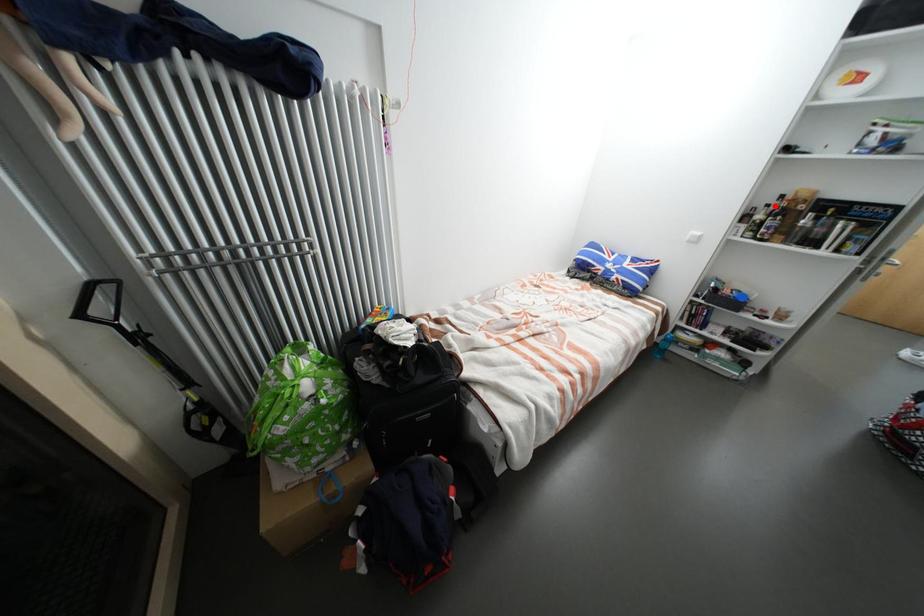
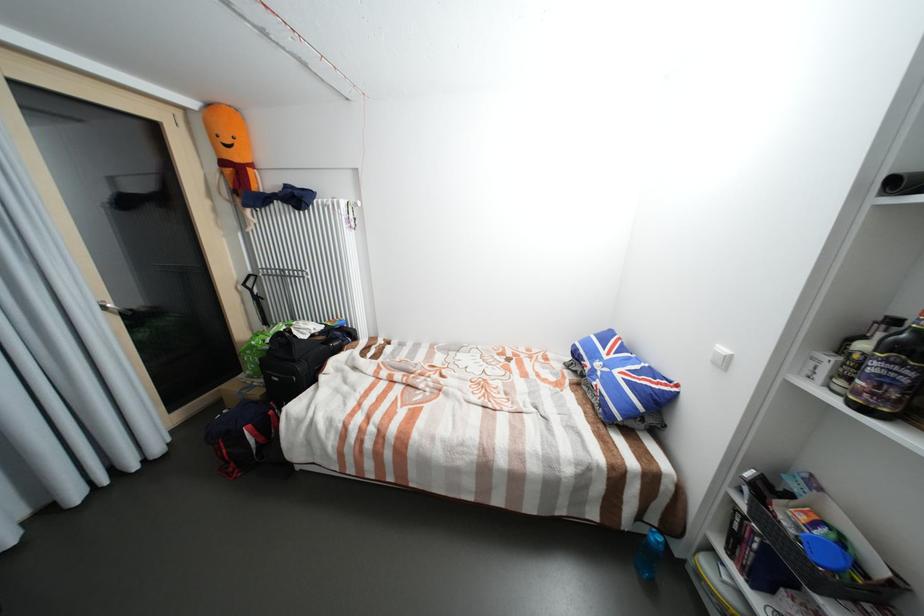
In the second image, find the point that corresponds to the highlighted location in the first image.

(901, 322)